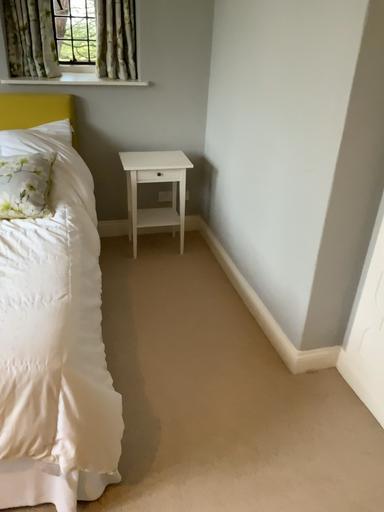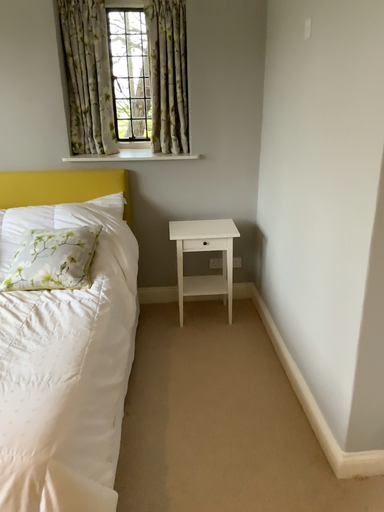
Question: How did the camera likely rotate when shooting the video?

Choices:
 (A) rotated upward
 (B) rotated downward

Answer: (A)